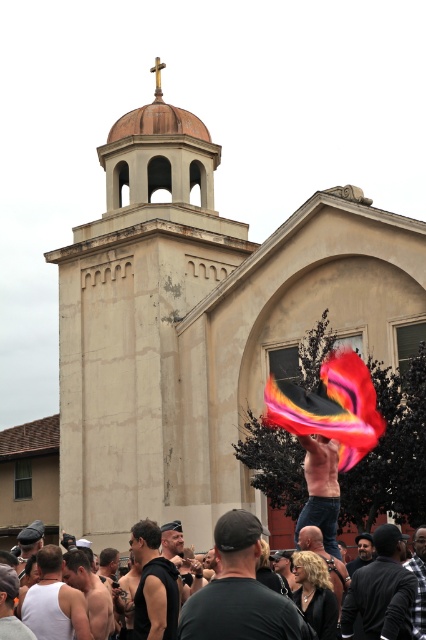
Can you confirm if black sleeveless shirt at center is positioned to the left of shiny black jacket at center?

Indeed, black sleeveless shirt at center is positioned on the left side of shiny black jacket at center.

Can you confirm if black sleeveless shirt at center is thinner than shiny black jacket at center?

In fact, black sleeveless shirt at center might be wider than shiny black jacket at center.

This screenshot has height=640, width=426. Find the location of `black sleeveless shirt at center`. black sleeveless shirt at center is located at coordinates (154, 586).

Between point (227, 568) and point (391, 554), which one is positioned behind?

The point (391, 554) is behind.

Find the location of `black cap at center`. black cap at center is located at coordinates (239, 593).

Between shiny metallic hat at center and matte black cap at lower left, which one is positioned lower?

matte black cap at lower left is lower down.

The image size is (426, 640). What do you see at coordinates (321, 490) in the screenshot? I see `shiny metallic hat at center` at bounding box center [321, 490].

At what (x,y) coordinates should I click in order to perform the action: click on shiny metallic hat at center. Please return your answer as a coordinate pair (x, y). Looking at the image, I should click on (321, 490).